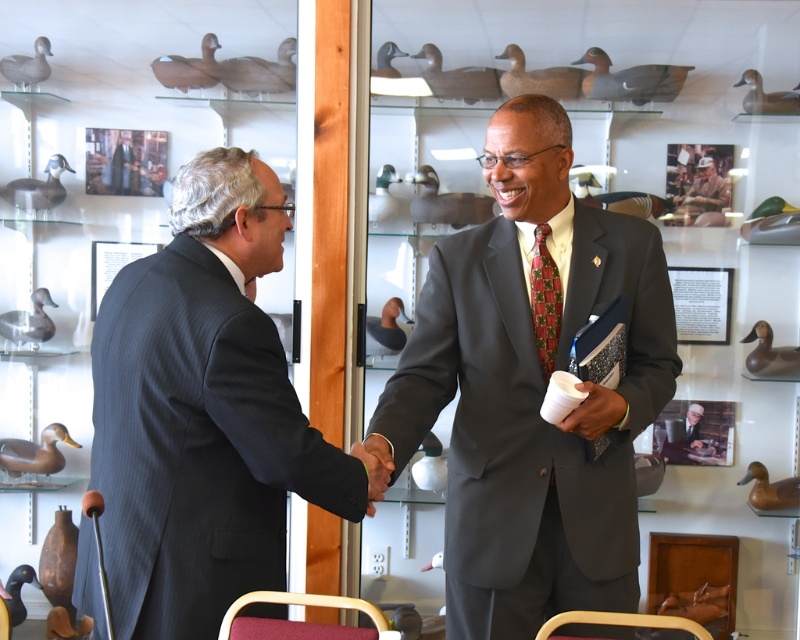
Is point (312, 445) farther from camera compared to point (701, 198)?

No, (312, 445) is in front of (701, 198).

Identify the location of dark gray suit at center. The width and height of the screenshot is (800, 640). (204, 412).

Find the location of a particular element. This screenshot has width=800, height=640. dark gray suit at center is located at coordinates (204, 412).

Who is positioned more to the left, smooth wooden frame at center or white matte cup at center?

white matte cup at center

Identify the location of smooth wooden frame at center. This screenshot has height=640, width=800. (696, 433).

Find the location of a particular element. The width and height of the screenshot is (800, 640). matte gray suit at center is located at coordinates (529, 390).

Does point (528, 132) come closer to viewer compared to point (558, 310)?

That is True.

Locate an element on the screen. matte gray suit at center is located at coordinates (529, 390).